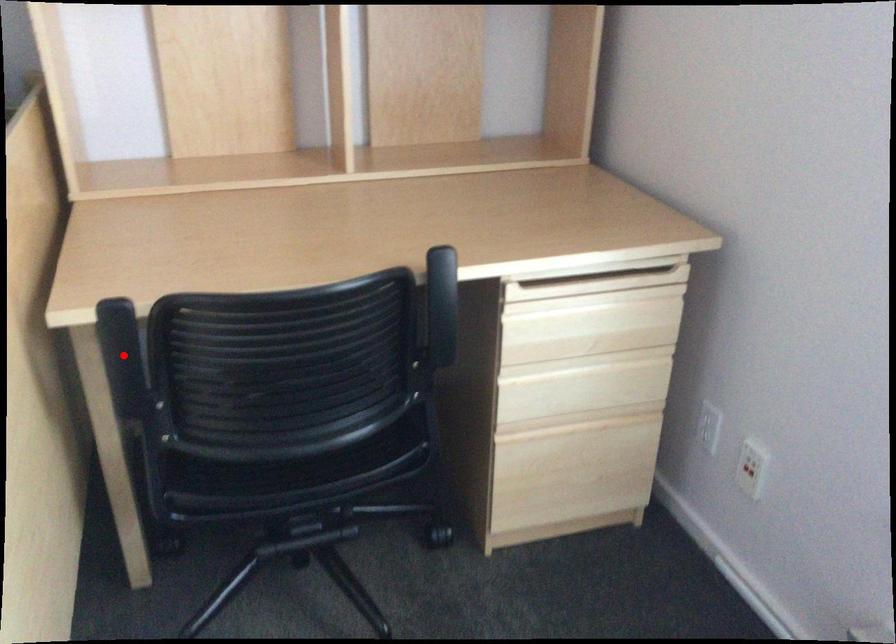
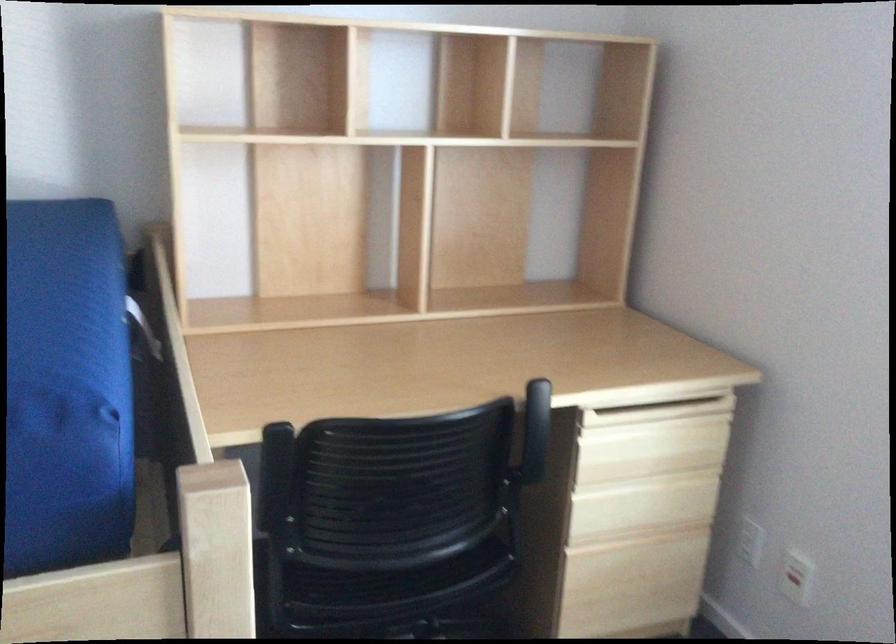
Where in the second image is the point corresponding to the highlighted location from the first image?

(273, 474)